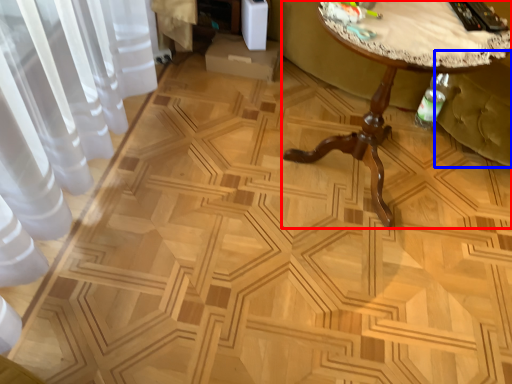
Question: Which object is closer to the camera taking this photo, table (highlighted by a red box) or swivel chair (highlighted by a blue box)?

Choices:
 (A) table
 (B) swivel chair

Answer: (A)